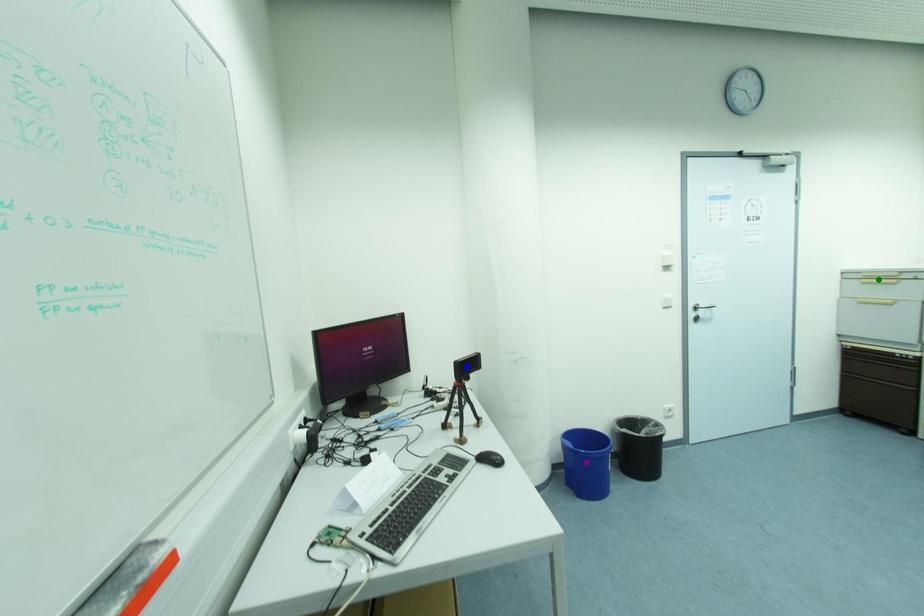
Order these from nearest to farthest:
1. purple point
2. green point
3. blue point

blue point, purple point, green point